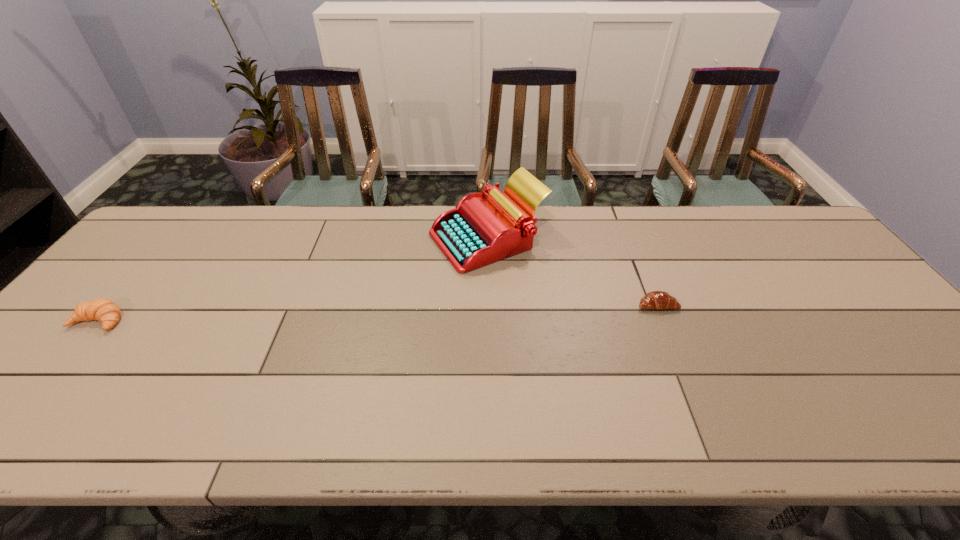
Locate an element on the screen. The width and height of the screenshot is (960, 540). vacant space that satisfies the following two spatial constraints: 1. on the typing side of the typewriter; 2. on the right side of the shorter crescent roll is located at coordinates (489, 305).

What are the coordinates of `free space in the image that satisfies the following two spatial constraints: 1. on the back side of the right crescent roll; 2. on the typing side of the second object from left to right` in the screenshot? It's located at click(x=631, y=239).

Locate an element on the screen. Image resolution: width=960 pixels, height=540 pixels. free region that satisfies the following two spatial constraints: 1. on the typing side of the second object from right to left; 2. on the right side of the shorter crescent roll is located at coordinates (489, 305).

Where is `free location that satisfies the following two spatial constraints: 1. on the typing side of the tallest object; 2. on the left side of the shortest object`? The image size is (960, 540). free location that satisfies the following two spatial constraints: 1. on the typing side of the tallest object; 2. on the left side of the shortest object is located at coordinates (489, 305).

Locate an element on the screen. free space in the image that satisfies the following two spatial constraints: 1. on the typing side of the shorter crescent roll; 2. on the right side of the typewriter is located at coordinates (489, 305).

This screenshot has height=540, width=960. Identify the location of free space that satisfies the following two spatial constraints: 1. on the back side of the shortest object; 2. on the typing side of the second object from left to right. (631, 239).

Locate an element on the screen. free point that satisfies the following two spatial constraints: 1. on the back side of the right crescent roll; 2. on the left side of the taller crescent roll is located at coordinates (112, 305).

Where is `free spot that satisfies the following two spatial constraints: 1. on the typing side of the farthest object; 2. on the right side of the right crescent roll`? The height and width of the screenshot is (540, 960). free spot that satisfies the following two spatial constraints: 1. on the typing side of the farthest object; 2. on the right side of the right crescent roll is located at coordinates (489, 305).

You are a GUI agent. You are given a task and a screenshot of the screen. Output one action in this format:
    pyautogui.click(x=<x>, y=<y>)
    Task: Click on the vacant space that satisfies the following two spatial constraints: 1. on the back side of the shorter crescent roll; 2. on the typing side of the farthest object
    The height and width of the screenshot is (540, 960).
    Given the screenshot: What is the action you would take?
    pyautogui.click(x=631, y=239)